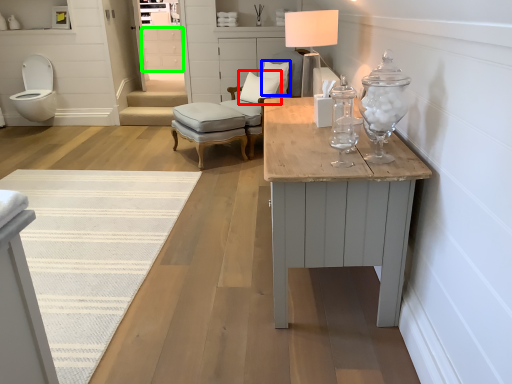
Question: Based on their relative distances, which object is farther from pillow (highlighted by a red box)? Choose from pillow (highlighted by a blue box) and drawer (highlighted by a green box).

Choices:
 (A) pillow
 (B) drawer

Answer: (B)